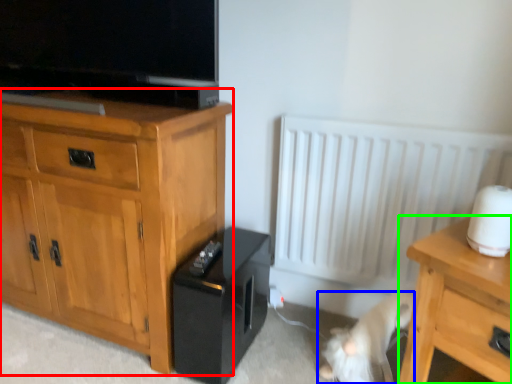
Question: Considering the real-world distances, which object is farthest from chest of drawers (highlighted by a red box)? animal (highlighted by a blue box) or nightstand (highlighted by a green box)?

Choices:
 (A) animal
 (B) nightstand

Answer: (B)